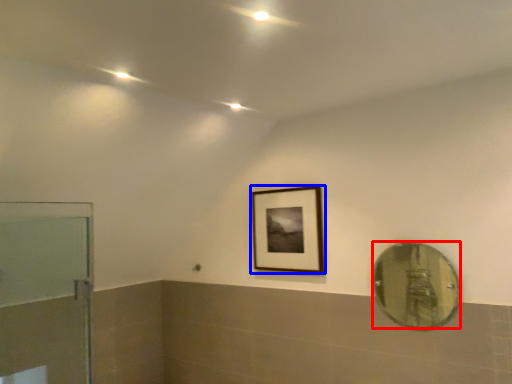
Question: Which object is further to the camera taking this photo, mirror (highlighted by a red box) or picture frame (highlighted by a blue box)?

Choices:
 (A) mirror
 (B) picture frame

Answer: (B)